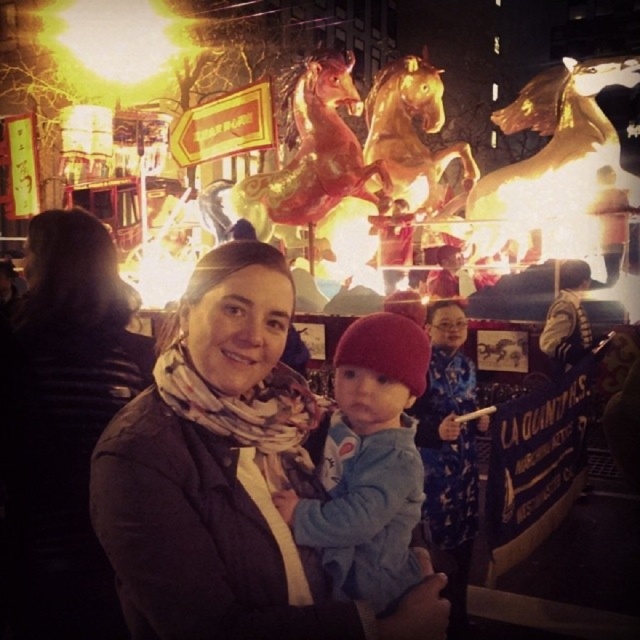
Question: Considering the relative positions of matte scarf at center and blue fleece jacket at center in the image provided, where is matte scarf at center located with respect to blue fleece jacket at center?

Choices:
 (A) above
 (B) below

Answer: (B)

Question: Which of the following is the closest to the observer?

Choices:
 (A) blue fleece jacket at center
 (B) matte scarf at center

Answer: (B)

Question: Which object is closer to the camera taking this photo?

Choices:
 (A) matte scarf at center
 (B) dark gray sweater at center

Answer: (A)

Question: Which point is farther to the camera?

Choices:
 (A) dark gray sweater at center
 (B) blue fleece jacket at center

Answer: (A)

Question: Observing the image, what is the correct spatial positioning of dark gray sweater at center in reference to blue fleece jacket at center?

Choices:
 (A) above
 (B) below

Answer: (A)

Question: Does dark gray sweater at center have a greater width compared to blue fleece jacket at center?

Choices:
 (A) yes
 (B) no

Answer: (A)